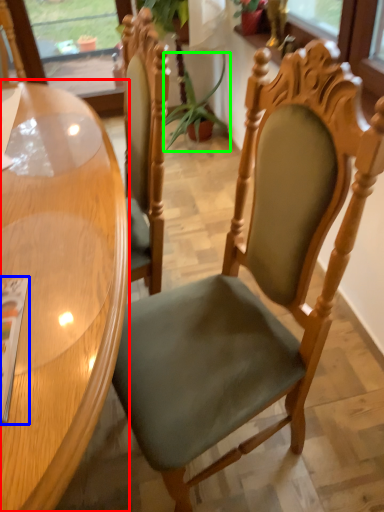
Question: Which is nearer to the table (highlighted by a red box)? magazine (highlighted by a blue box) or plant (highlighted by a green box).

Choices:
 (A) magazine
 (B) plant

Answer: (A)